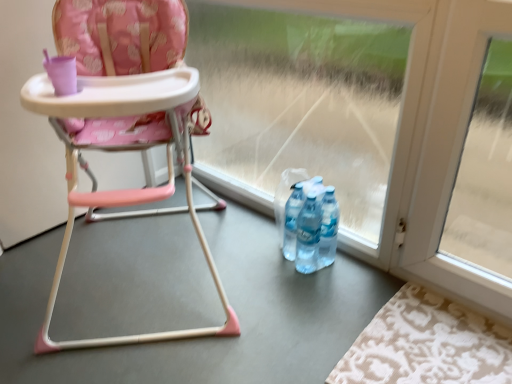
The image size is (512, 384). I want to click on vacant space underneath matte plastic highchair at center (from a real-world perspective), so click(150, 268).